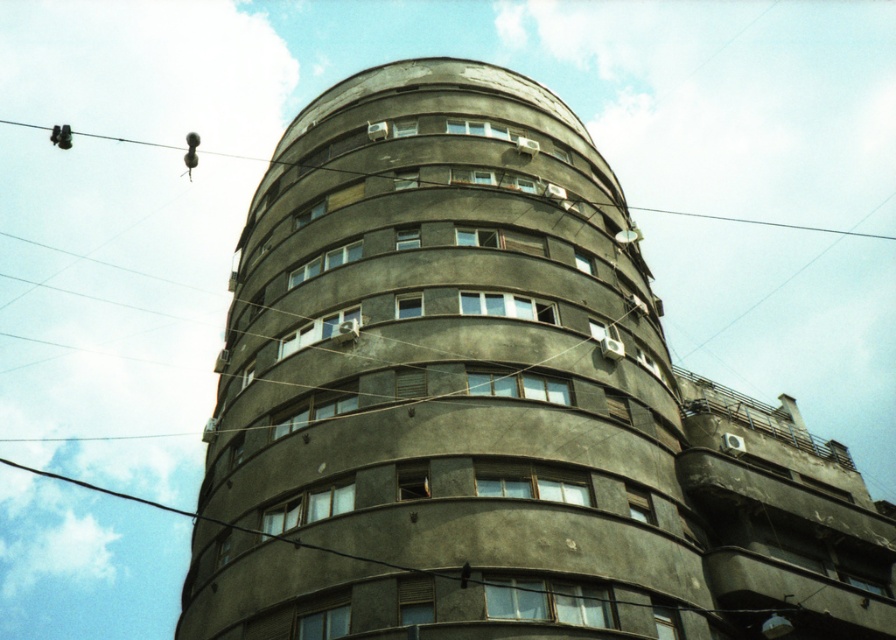
Which is behind, point (378, 154) or point (794, 227)?

Positioned behind is point (794, 227).

Between dark gray concrete building at center and metallic wire at upper center, which one is positioned lower?

dark gray concrete building at center is lower down.

You are a GUI agent. You are given a task and a screenshot of the screen. Output one action in this format:
    pyautogui.click(x=<x>, y=<y>)
    Task: Click on the dark gray concrete building at center
    
    Given the screenshot: What is the action you would take?
    pyautogui.click(x=442, y=384)

I want to click on dark gray concrete building at center, so click(442, 384).